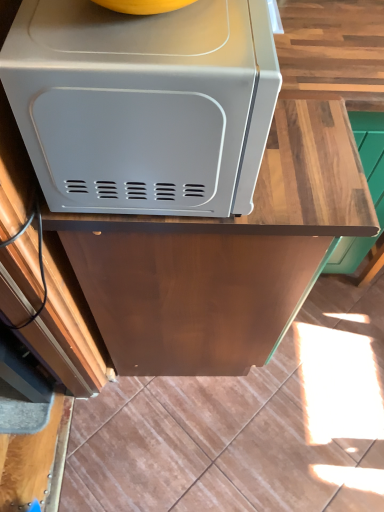
Question: Are satin white microwave at upper left and wooden at upper center far apart?

Choices:
 (A) no
 (B) yes

Answer: (A)

Question: From the image's perspective, is satin white microwave at upper left located above wooden at upper center?

Choices:
 (A) no
 (B) yes

Answer: (B)

Question: Considering the relative positions of satin white microwave at upper left and wooden at upper center in the image provided, is satin white microwave at upper left to the right of wooden at upper center from the viewer's perspective?

Choices:
 (A) no
 (B) yes

Answer: (A)

Question: Can you confirm if satin white microwave at upper left is bigger than wooden at upper center?

Choices:
 (A) no
 (B) yes

Answer: (A)

Question: Is satin white microwave at upper left turned away from wooden at upper center?

Choices:
 (A) yes
 (B) no

Answer: (B)

Question: Is the depth of satin white microwave at upper left less than that of wooden at upper center?

Choices:
 (A) yes
 (B) no

Answer: (A)

Question: From a real-world perspective, is wooden at upper center physically below satin white microwave at upper left?

Choices:
 (A) yes
 (B) no

Answer: (A)

Question: From a real-world perspective, is wooden at upper center physically above satin white microwave at upper left?

Choices:
 (A) yes
 (B) no

Answer: (B)

Question: Can you confirm if wooden at upper center is positioned to the right of satin white microwave at upper left?

Choices:
 (A) yes
 (B) no

Answer: (A)

Question: Does wooden at upper center appear on the left side of satin white microwave at upper left?

Choices:
 (A) yes
 (B) no

Answer: (B)

Question: Is wooden at upper center wider than satin white microwave at upper left?

Choices:
 (A) no
 (B) yes

Answer: (B)

Question: From the image's perspective, is wooden at upper center under satin white microwave at upper left?

Choices:
 (A) yes
 (B) no

Answer: (A)

Question: Is point (357, 199) positioned closer to the camera than point (112, 22)?

Choices:
 (A) closer
 (B) farther

Answer: (B)